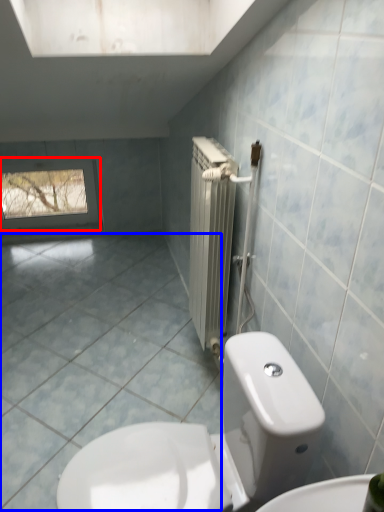
Question: Which of the following is the closest to the observer, window (highlighted by a red box) or ceramic tile (highlighted by a blue box)?

Choices:
 (A) window
 (B) ceramic tile

Answer: (B)